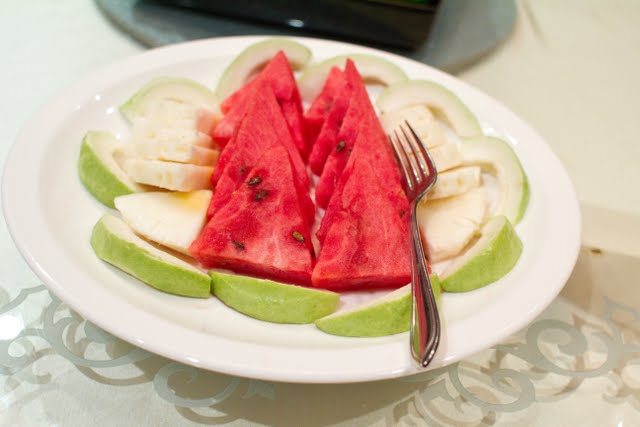
At what (x,y) coordinates should I click in order to perform the action: click on plate. Please return your answer as a coordinate pair (x, y). This screenshot has width=640, height=427. Looking at the image, I should click on (335, 374).